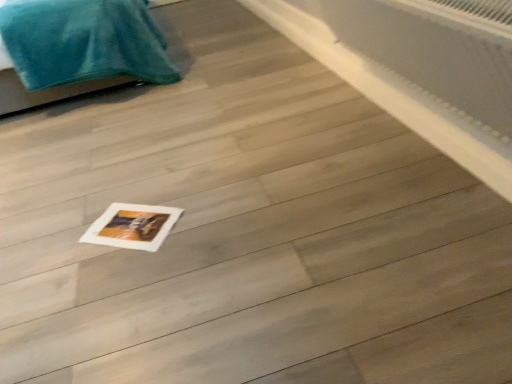
The image size is (512, 384). Find the location of `empty space that is ontop of white glossy magazine at center (from a real-world perspective)`. empty space that is ontop of white glossy magazine at center (from a real-world perspective) is located at coordinates (131, 223).